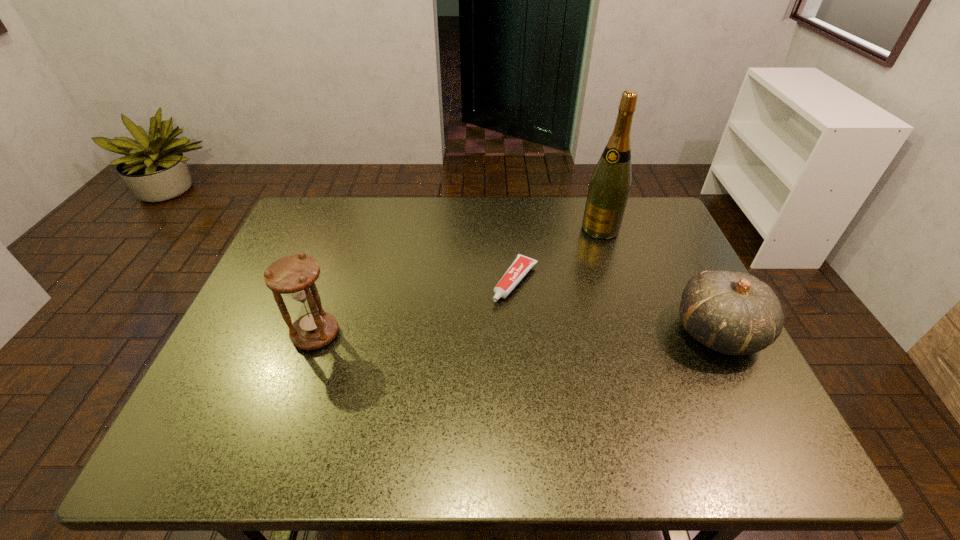
Image resolution: width=960 pixels, height=540 pixels. I want to click on the leftmost object, so click(x=294, y=275).

Locate an element on the screen. This screenshot has height=540, width=960. hourglass is located at coordinates (294, 275).

At what (x,y) coordinates should I click in order to perform the action: click on gourd. Please return your answer as a coordinate pair (x, y). Looking at the image, I should click on (734, 313).

The width and height of the screenshot is (960, 540). Identify the location of the rightmost object. (734, 313).

Where is `wine bottle`? The image size is (960, 540). wine bottle is located at coordinates (609, 188).

Find the location of `the third object from left to right`. the third object from left to right is located at coordinates (609, 188).

The image size is (960, 540). I want to click on the third object from right to left, so click(520, 267).

What are the coordinates of `toothpaste` in the screenshot? It's located at (520, 267).

I want to click on blank space located on the back of the leftmost object, so click(332, 286).

At what (x,y) coordinates should I click in order to perform the action: click on free spot located 0.060m on the back of the gourd. Please return your answer as a coordinate pair (x, y). Image resolution: width=960 pixels, height=540 pixels. Looking at the image, I should click on (693, 283).